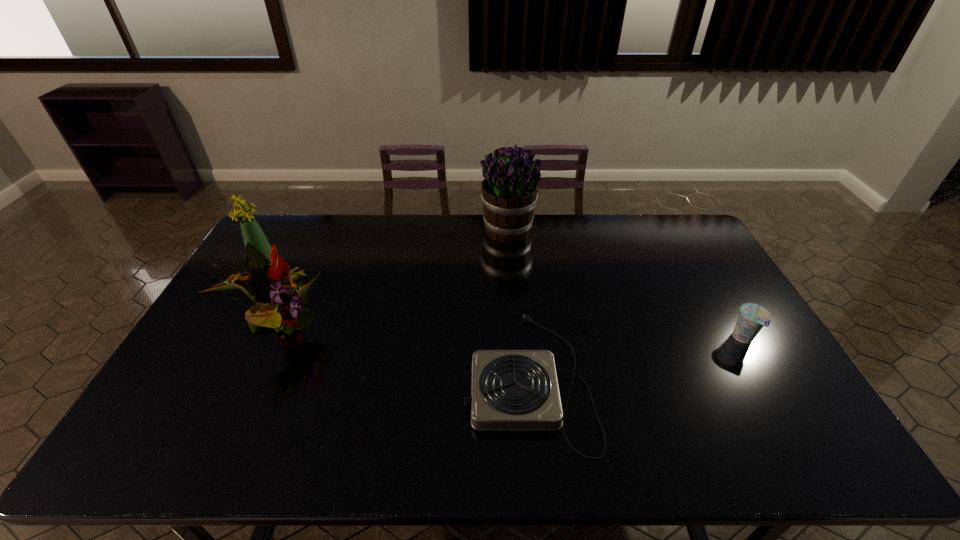
Locate an element on the screen. vacant space at the left edge of the desktop is located at coordinates (208, 378).

Where is `vacant area at the right edge of the desktop`? This screenshot has height=540, width=960. vacant area at the right edge of the desktop is located at coordinates (798, 405).

Locate an element on the screen. The image size is (960, 540). free space at the far left corner of the desktop is located at coordinates (283, 239).

I want to click on unoccupied area between the rightmost object and the farthest object, so click(626, 284).

Identify the location of vacant point located between the farthest object and the second farthest bouquet. (388, 249).

The width and height of the screenshot is (960, 540). In order to click on unoccupied position between the second bouquet from left to right and the rightmost bouquet in this screenshot , I will do `click(396, 282)`.

Locate an element on the screen. The height and width of the screenshot is (540, 960). free spot between the rightmost bouquet and the shortest object is located at coordinates (518, 305).

What are the coordinates of `free space between the shortest object and the rightmost bouquet` in the screenshot? It's located at (518, 305).

Where is `vacant space that's between the rightmost bouquet and the rightmost object`? This screenshot has height=540, width=960. vacant space that's between the rightmost bouquet and the rightmost object is located at coordinates (626, 284).

Image resolution: width=960 pixels, height=540 pixels. Identify the location of vacant area that lies between the yogurt and the hotplate. (636, 359).